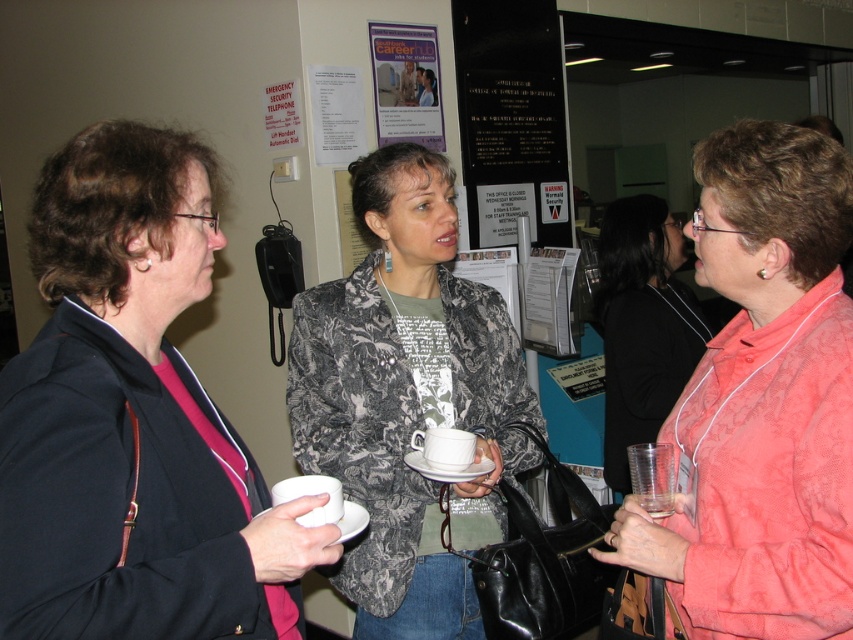
You are at a professional event and need to locate the Careers poster. You see the white glossy poster at upper center and the white paper poster at upper left. Which one is to the right of the other?

The white glossy poster at upper center is positioned on the right side of the white paper poster at upper left.

You are organizing a poster session and need to know which item on the wall is larger. Looking at the white glossy poster at upper center and the white paper at upper center, which one is bigger?

The white glossy poster at upper center is bigger than the white paper at upper center.